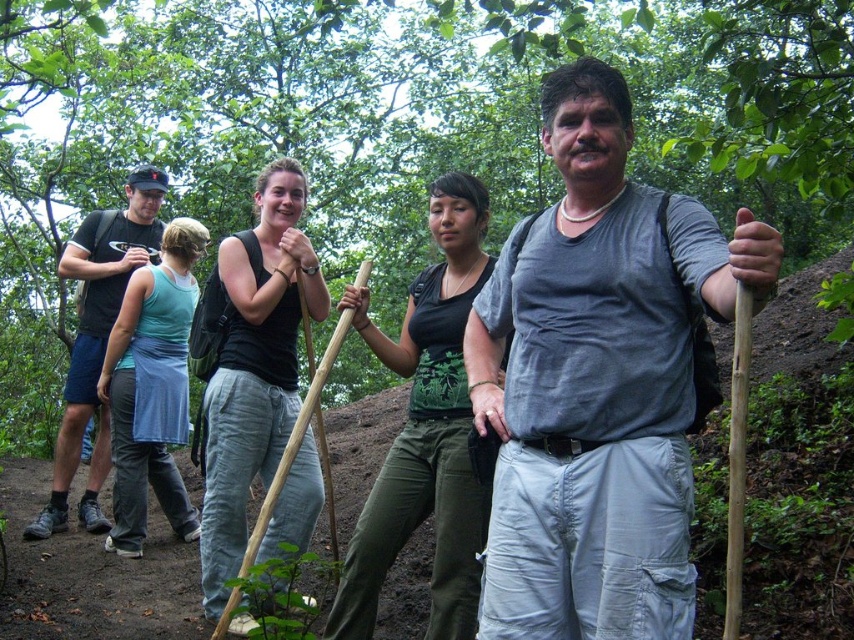
Is black cotton tank top at center bigger than matte black backpack at left?

No.

Is point (240, 544) in front of point (44, 536)?

Yes, point (240, 544) is closer to viewer.

The width and height of the screenshot is (854, 640). I want to click on black cotton tank top at center, so click(253, 365).

Does green leafy tree at upper center have a smaller size compared to green matte shirt at center?

No, green leafy tree at upper center is not smaller than green matte shirt at center.

Is green leafy tree at upper center to the right of green matte shirt at center from the viewer's perspective?

Correct, you'll find green leafy tree at upper center to the right of green matte shirt at center.

Is point (284, 116) closer to viewer compared to point (483, 504)?

No, it is behind (483, 504).

Locate an element on the screen. green leafy tree at upper center is located at coordinates (395, 124).

Between black cotton tank top at center and teal fabric skirt at left, which one appears on the right side from the viewer's perspective?

black cotton tank top at center

The image size is (854, 640). What do you see at coordinates (253, 365) in the screenshot? I see `black cotton tank top at center` at bounding box center [253, 365].

The height and width of the screenshot is (640, 854). What do you see at coordinates (253, 365) in the screenshot?
I see `black cotton tank top at center` at bounding box center [253, 365].

Find the location of `black cotton tank top at center`. black cotton tank top at center is located at coordinates (253, 365).